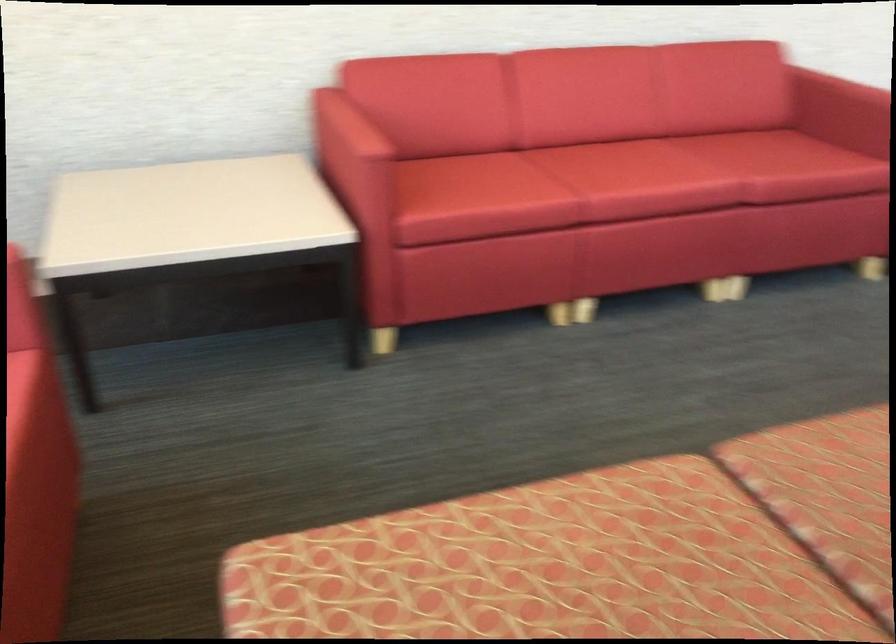
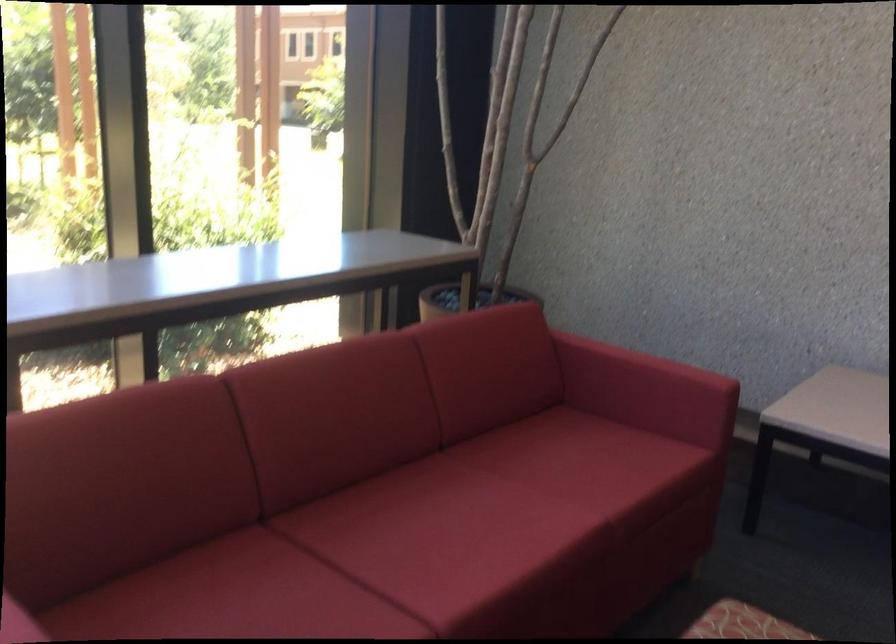
Question: The first image is from the beginning of the video and the second image is from the end. How did the camera likely rotate when shooting the video?

Choices:
 (A) Left
 (B) Right
 (C) Up
 (D) Down

Answer: (A)